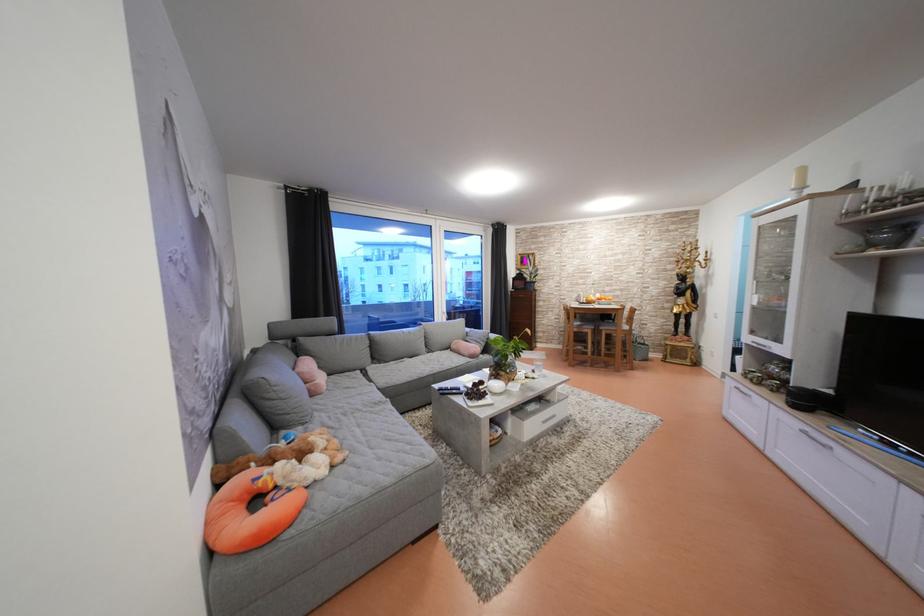
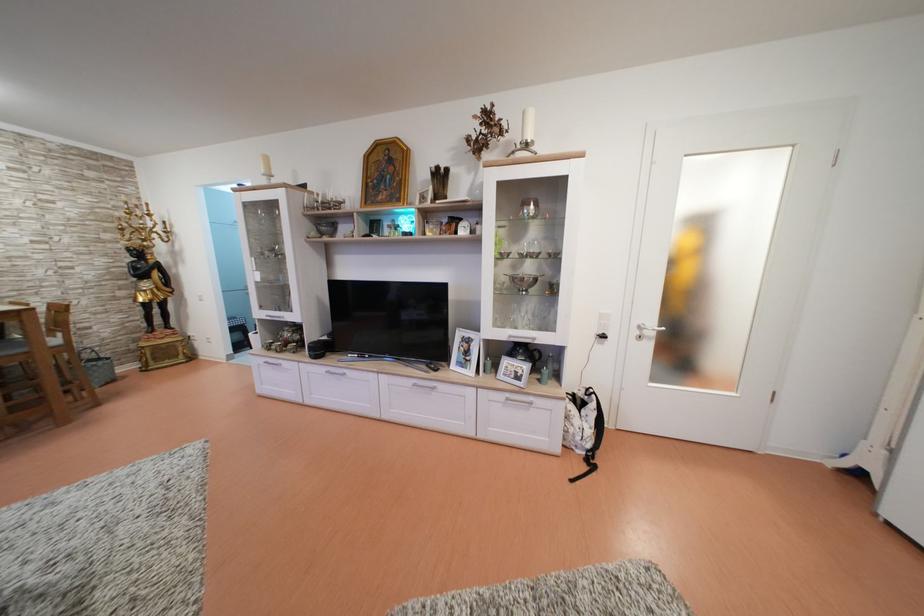
The point at (815, 434) is marked in the first image. Where is the corresponding point in the second image?

(335, 374)